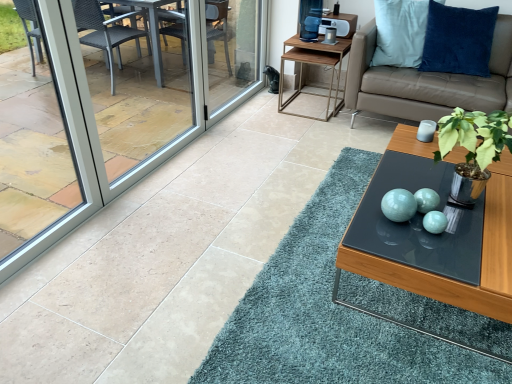
At what (x,y) coordinates should I click in order to perform the action: click on free point behind matte turquoise spheres at center. Please return your answer as a coordinate pair (x, y). Looking at the image, I should click on pos(381,190).